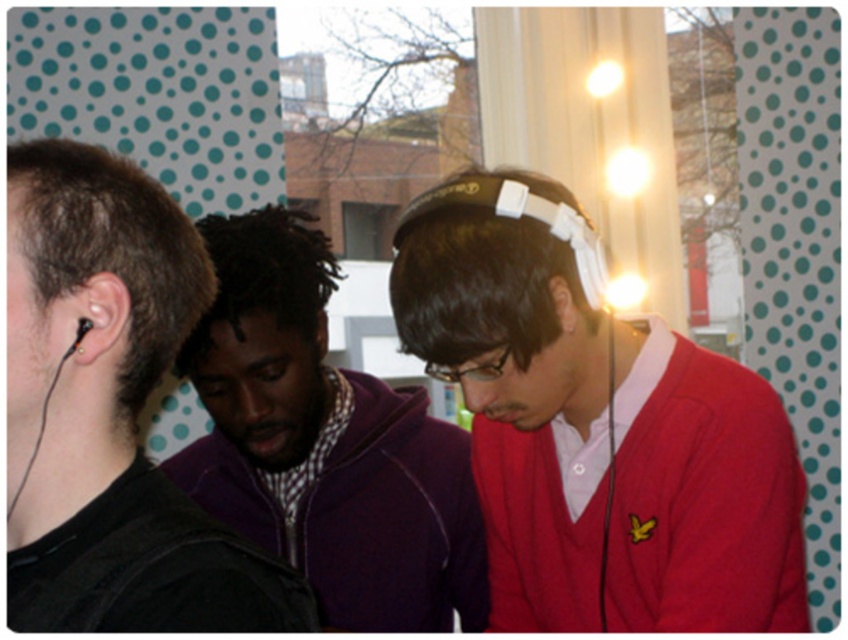
Question: Which is nearer to the matte skin ear at center?

Choices:
 (A) purple fleece jacket at center
 (B) matte black ear at center
 (C) matte white headphones at center

Answer: (C)

Question: Is black matte earphones at left wider than matte black ear at center?

Choices:
 (A) no
 (B) yes

Answer: (B)

Question: Does matte skin ear at center have a larger size compared to black matte earphone at left?

Choices:
 (A) no
 (B) yes

Answer: (B)

Question: In this image, where is black matte earbud at left located relative to black matte earphone at left?

Choices:
 (A) below
 (B) above

Answer: (B)

Question: Among these points, which one is farthest from the camera?

Choices:
 (A) (91, 324)
 (B) (120, 346)
 (C) (550, 300)
 (D) (489, 216)

Answer: (C)

Question: Which object is farther from the camera taking this photo?

Choices:
 (A) black matte earphones at left
 (B) black matte earbud at left
 (C) matte white headphones at center

Answer: (C)